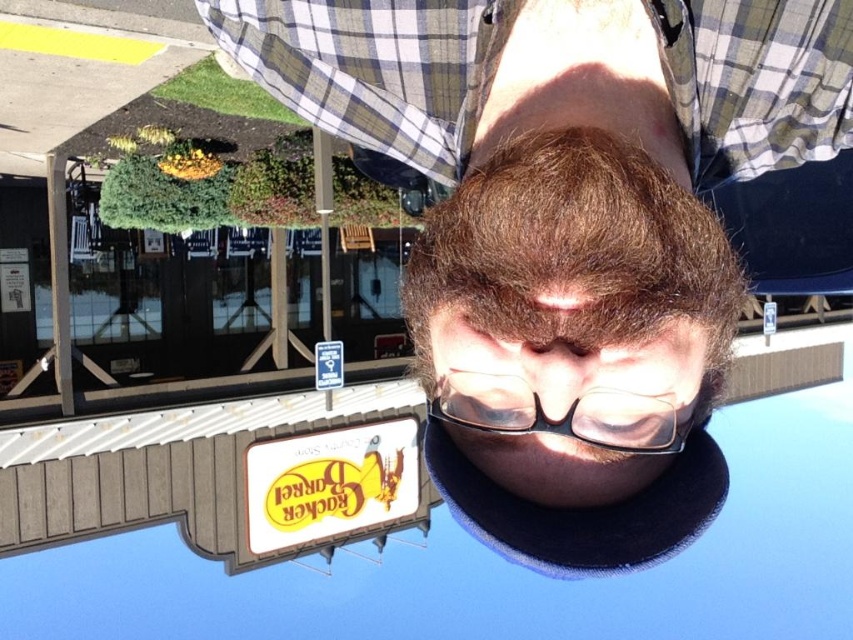
Question: Which object is closer to the camera taking this photo?

Choices:
 (A) white matte sign at lower center
 (B) brown matte hair at center
 (C) matte black cap at center

Answer: (B)

Question: From the image, what is the correct spatial relationship of brown matte hair at center in relation to transparent plastic glasses at center?

Choices:
 (A) right
 (B) left

Answer: (A)

Question: Does white matte sign at lower center appear on the left side of transparent plastic glasses at center?

Choices:
 (A) yes
 (B) no

Answer: (A)

Question: Can you confirm if matte black cap at center is wider than white matte sign at lower center?

Choices:
 (A) yes
 (B) no

Answer: (B)

Question: Among these points, which one is nearest to the camera?

Choices:
 (A) (305, 438)
 (B) (672, 404)
 (C) (599, 294)
 (D) (776, 148)

Answer: (C)

Question: Which point is closer to the camera taking this photo?

Choices:
 (A) (647, 74)
 (B) (553, 420)

Answer: (B)